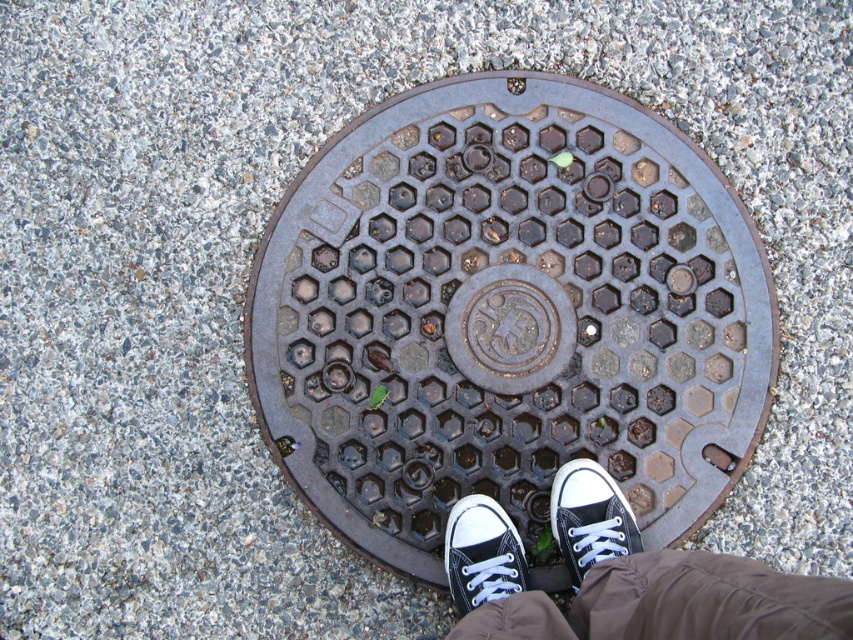
You are a delivery person who needs to step onto the manhole cover to avoid a puddle. The manhole cover has a diameter of 24 inches. Can both your black canvas shoes at center and white canvas shoe at center fit on the cover without overlapping each other?

The black canvas shoes at center and white canvas shoe at center are 6.17 inches apart from each other. Since the manhole cover has a diameter of 24 inches, there is enough space for both shoes to fit without overlapping as the distance between them is significantly smaller than the cover diameter.

You are a construction worker inspecting a manhole cover. You notice the rusty metal manhole cover at center and the black canvas shoe at center. Based on their positions, which object is closer to you?

The black canvas shoe at center is closer to you because the rusty metal manhole cover at center is located above it, meaning the shoe is beneath the cover and thus nearer to your viewpoint.

You are a construction worker assessing a site. You see the rusty metal manhole cover at center and the black canvas shoe at center. Which object is elevated higher in the scene?

The rusty metal manhole cover at center is elevated higher than the black canvas shoe at center because the description states it is much taller.